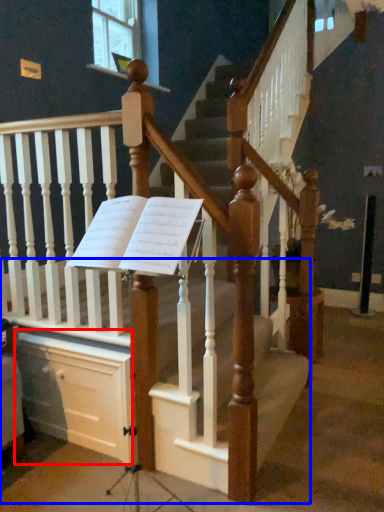
Question: Which of the following is the closest to the observer, drawer (highlighted by a red box) or stairs (highlighted by a blue box)?

Choices:
 (A) drawer
 (B) stairs

Answer: (B)